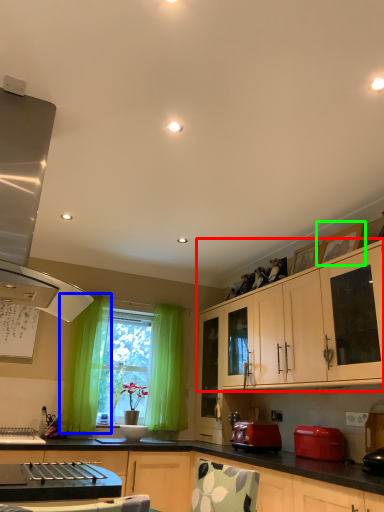
Question: Which is nearer to the cabinetry (highlighted by a red box)? curtain (highlighted by a blue box) or picture frame (highlighted by a green box).

Choices:
 (A) curtain
 (B) picture frame

Answer: (B)